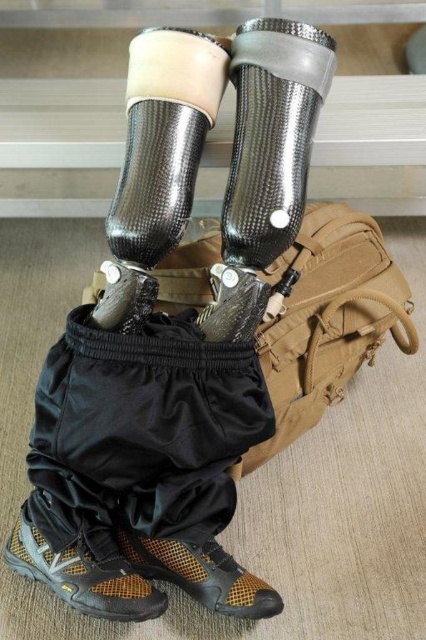
Is carbon fiber boot at center wider than textured brown shoe at lower left?

In fact, carbon fiber boot at center might be narrower than textured brown shoe at lower left.

Measure the distance from carbon fiber boot at center to textured brown shoe at lower left.

They are 27.32 inches apart.

I want to click on carbon fiber boot at center, so click(158, 161).

Identify the location of carbon fiber boot at center. The image size is (426, 640). (158, 161).

Between textured brown shoe at lower left and brown mesh shoe at lower left, which one has more height?

Standing taller between the two is textured brown shoe at lower left.

Does textured brown shoe at lower left appear under brown mesh shoe at lower left?

No.

Image resolution: width=426 pixels, height=640 pixels. What are the coordinates of `textured brown shoe at lower left` in the screenshot? It's located at (83, 577).

Identify the location of textured brown shoe at lower left. (83, 577).

Does carbon fiber boot at center come in front of brown mesh shoe at lower left?

That is True.

Is point (215, 108) farther from camera compared to point (195, 557)?

No, (215, 108) is closer to viewer.

This screenshot has height=640, width=426. In order to click on carbon fiber boot at center in this screenshot , I will do `click(158, 161)`.

Where is `carbon fiber boot at center`? carbon fiber boot at center is located at coordinates (158, 161).